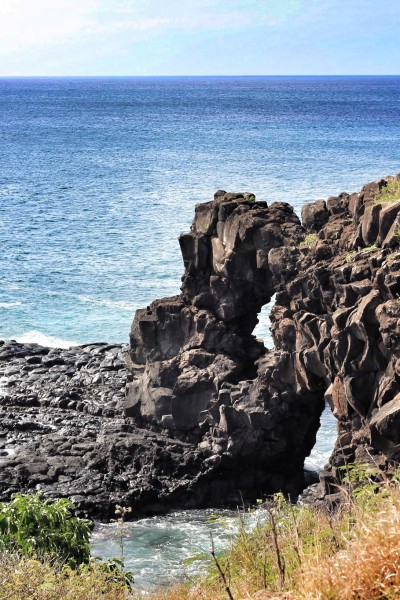
What are the coordinates of `light source` in the screenshot? It's located at (40, 27).